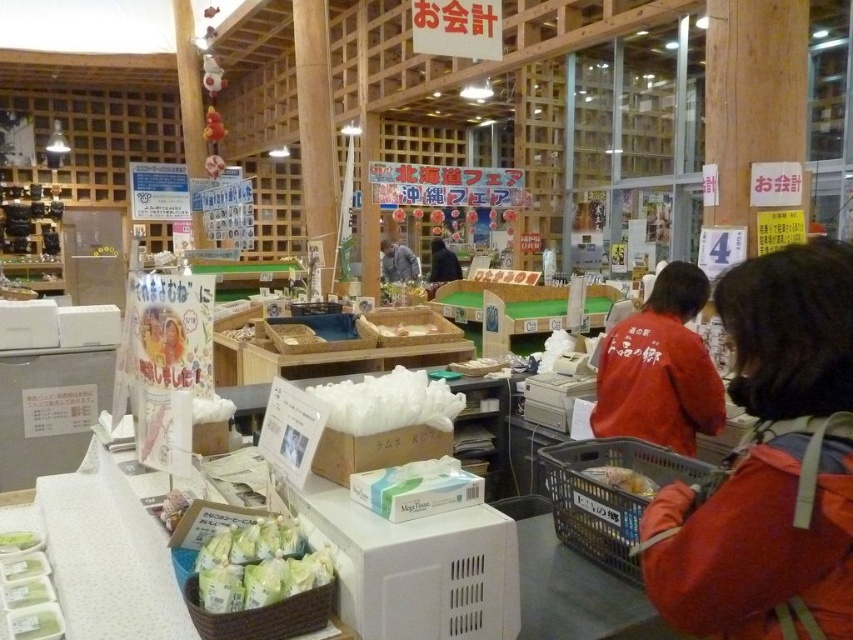
Question: Is plastic basket at lower right thinner than green woven basket at lower center?

Choices:
 (A) no
 (B) yes

Answer: (A)

Question: Which object is closer to the camera taking this photo?

Choices:
 (A) green woven basket at lower center
 (B) plastic basket at lower right
 (C) red matte shirt at center
 (D) dark blue shirt at center

Answer: (A)

Question: Which point appears closest to the camera in this image?

Choices:
 (A) (579, 496)
 (B) (656, 413)
 (C) (267, 608)
 (D) (389, 403)

Answer: (C)

Question: Among these points, which one is farthest from the camera?

Choices:
 (A) (251, 538)
 (B) (671, 307)
 (C) (631, 472)

Answer: (B)

Question: Is white styrofoam food at center further to the viewer compared to gray fabric jacket at center?

Choices:
 (A) yes
 (B) no

Answer: (B)

Question: Can you confirm if plastic basket at lower right is thinner than gray fabric jacket at center?

Choices:
 (A) no
 (B) yes

Answer: (B)